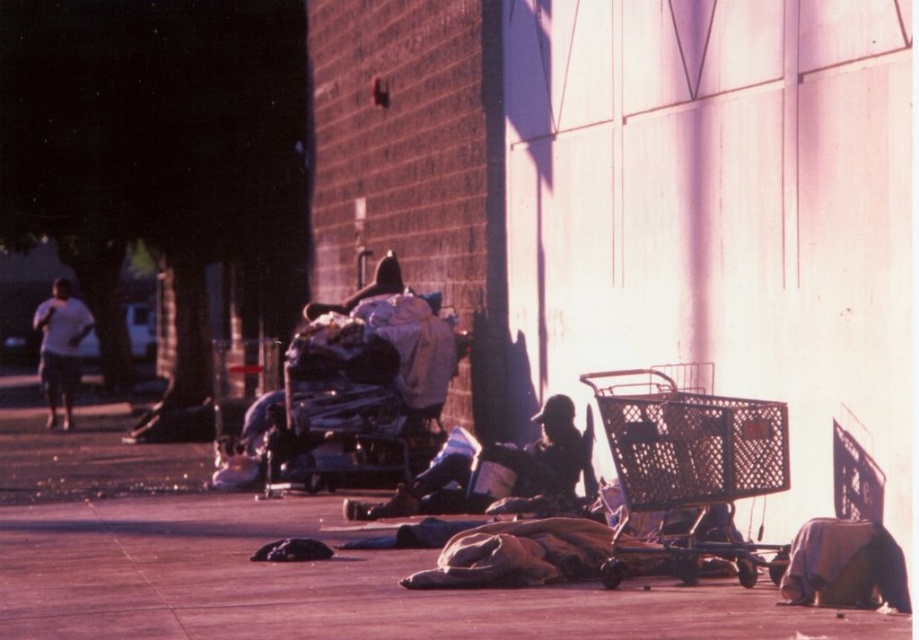
Which is behind, point (700, 406) or point (62, 385)?

The point (62, 385) is behind.

Is metallic silver shopping cart at lower right smaller than white cotton shirt at left?

Indeed, metallic silver shopping cart at lower right has a smaller size compared to white cotton shirt at left.

Identify the location of metallic silver shopping cart at lower right. (689, 461).

The height and width of the screenshot is (640, 919). Find the location of `metallic silver shopping cart at lower right`. metallic silver shopping cart at lower right is located at coordinates (689, 461).

Between smooth concrete pavement at lower center and metallic silver shopping cart at lower right, which one is positioned lower?

Positioned lower is smooth concrete pavement at lower center.

Is point (358, 566) less distant than point (628, 465)?

No, it is not.

Locate an element on the screen. The image size is (919, 640). smooth concrete pavement at lower center is located at coordinates (328, 586).

Which of these two, smooth concrete pavement at lower center or white cotton shirt at left, stands shorter?

smooth concrete pavement at lower center is shorter.

Consider the image. Can you confirm if smooth concrete pavement at lower center is positioned to the right of white cotton shirt at left?

Indeed, smooth concrete pavement at lower center is positioned on the right side of white cotton shirt at left.

The height and width of the screenshot is (640, 919). What do you see at coordinates (328, 586) in the screenshot? I see `smooth concrete pavement at lower center` at bounding box center [328, 586].

Find the location of `smooth concrete pavement at lower center`. smooth concrete pavement at lower center is located at coordinates (328, 586).